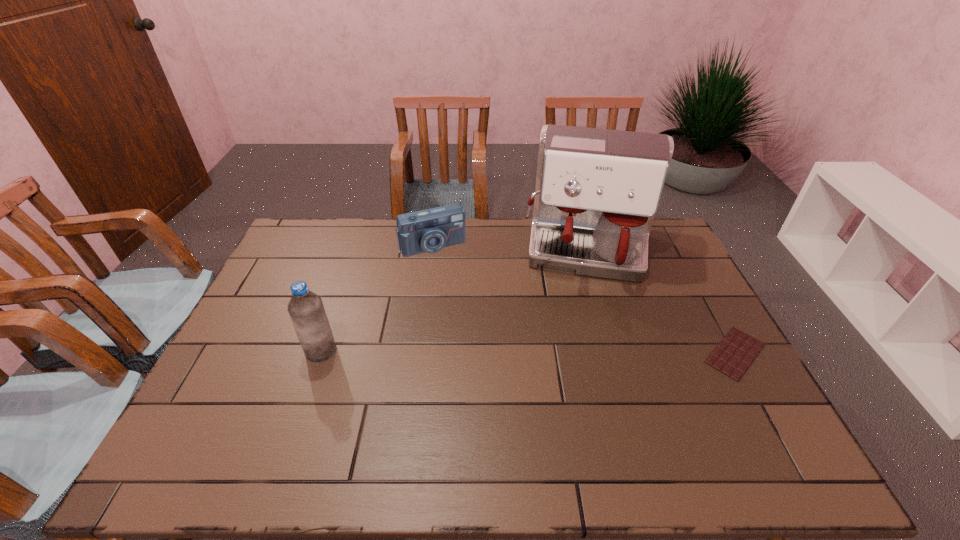
Identify the location of water bottle. Image resolution: width=960 pixels, height=540 pixels. (306, 310).

Find the location of a particular element. the leftmost object is located at coordinates (306, 310).

The height and width of the screenshot is (540, 960). Identify the location of chocolate bar. pyautogui.click(x=736, y=351).

Locate an element on the screen. The height and width of the screenshot is (540, 960). the third tallest object is located at coordinates (430, 230).

Locate an element on the screen. the third object from right to left is located at coordinates (430, 230).

Where is `the tallest object`? This screenshot has height=540, width=960. the tallest object is located at coordinates (597, 191).

Image resolution: width=960 pixels, height=540 pixels. I want to click on blank space located on the right of the water bottle, so click(x=358, y=351).

Where is `free space located 0.070m on the back of the chocolate bar`? free space located 0.070m on the back of the chocolate bar is located at coordinates [x=711, y=310].

Identify the location of blank space located 0.100m on the lens of the camera. (452, 275).

The height and width of the screenshot is (540, 960). I want to click on free space located 0.180m on the lens of the camera, so click(x=460, y=291).